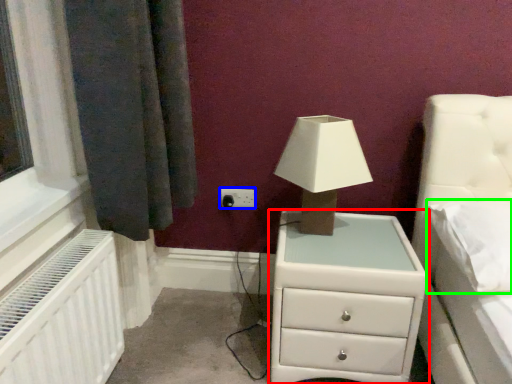
Question: Estimate the real-world distances between objects in this image. Which object is closer to chest of drawers (highlighted by a red box), electric outlet (highlighted by a blue box) or pillow (highlighted by a green box)?

Choices:
 (A) electric outlet
 (B) pillow

Answer: (B)